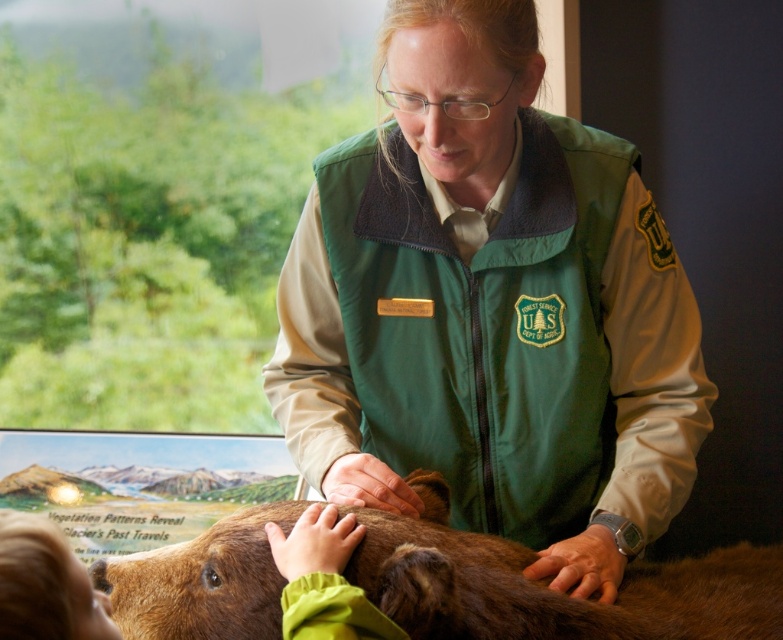
Looking at this image, which is above, green fleece vest at center or brown furry bear at center?

green fleece vest at center is above.

This screenshot has height=640, width=783. Describe the element at coordinates (495, 336) in the screenshot. I see `green fleece vest at center` at that location.

This screenshot has width=783, height=640. In order to click on green fleece vest at center in this screenshot , I will do `click(495, 336)`.